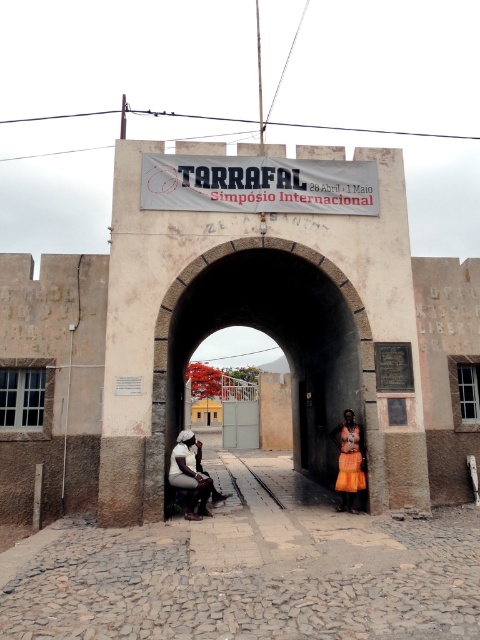
Question: Can you confirm if stone archway at center is positioned below orange fabric skirt at center?

Choices:
 (A) no
 (B) yes

Answer: (B)

Question: Is stone archway at center thinner than orange fabric skirt at center?

Choices:
 (A) yes
 (B) no

Answer: (A)

Question: Where is stone archway at center located in relation to orange fabric skirt at center in the image?

Choices:
 (A) right
 (B) left

Answer: (A)

Question: Which object appears farthest from the camera in this image?

Choices:
 (A) orange fabric skirt at center
 (B) stone archway at center

Answer: (B)

Question: Which object appears closest to the camera in this image?

Choices:
 (A) orange fabric skirt at center
 (B) stone archway at center

Answer: (A)

Question: Which object is closer to the camera taking this photo?

Choices:
 (A) stone archway at center
 (B) orange fabric skirt at center

Answer: (B)